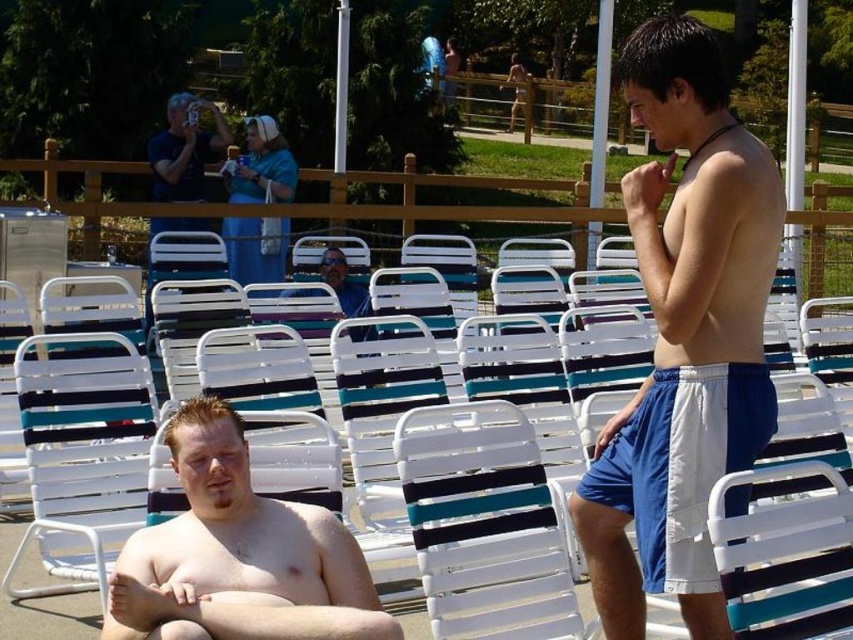
Between white plastic chair at lower left and matte black camera at upper left, which one has more height?

white plastic chair at lower left is taller.

Is white plastic chair at lower left positioned in front of matte black camera at upper left?

Yes, it is.

The height and width of the screenshot is (640, 853). Identify the location of white plastic chair at lower left. (82, 452).

Between white plastic chair at center and matte blue shirt at center, which one has less height?

matte blue shirt at center is shorter.

Can you confirm if white plastic chair at center is positioned to the left of matte blue shirt at center?

Incorrect, white plastic chair at center is not on the left side of matte blue shirt at center.

Identify the location of white plastic chair at center. (103, 269).

Is white cotton shorts at center smaller than white plastic chair at center?

Correct, white cotton shorts at center occupies less space than white plastic chair at center.

Is white cotton shorts at center above white plastic chair at center?

Yes, white cotton shorts at center is above white plastic chair at center.

Does point (747, 394) come behind point (427, 260)?

No, it is not.

This screenshot has height=640, width=853. I want to click on white cotton shorts at center, so pos(683,337).